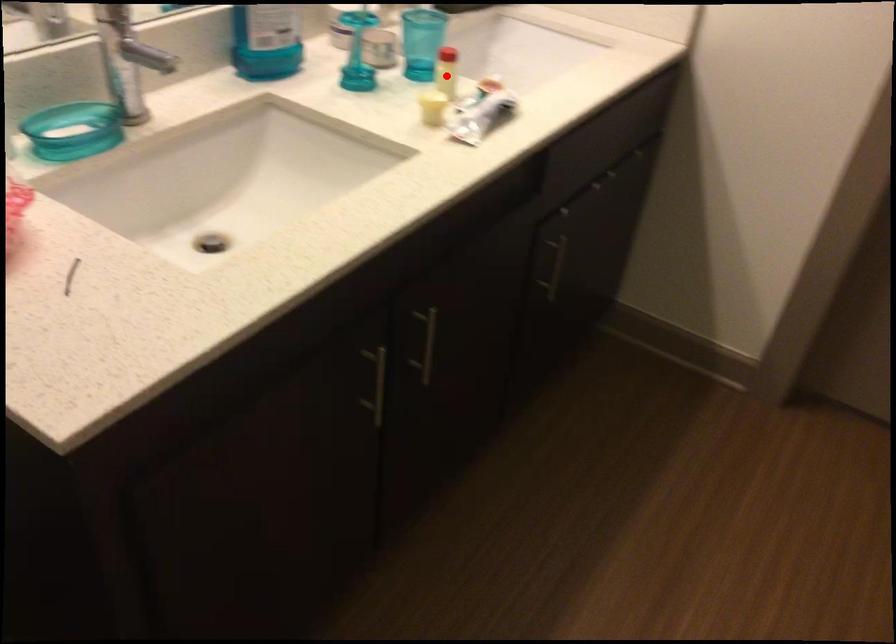
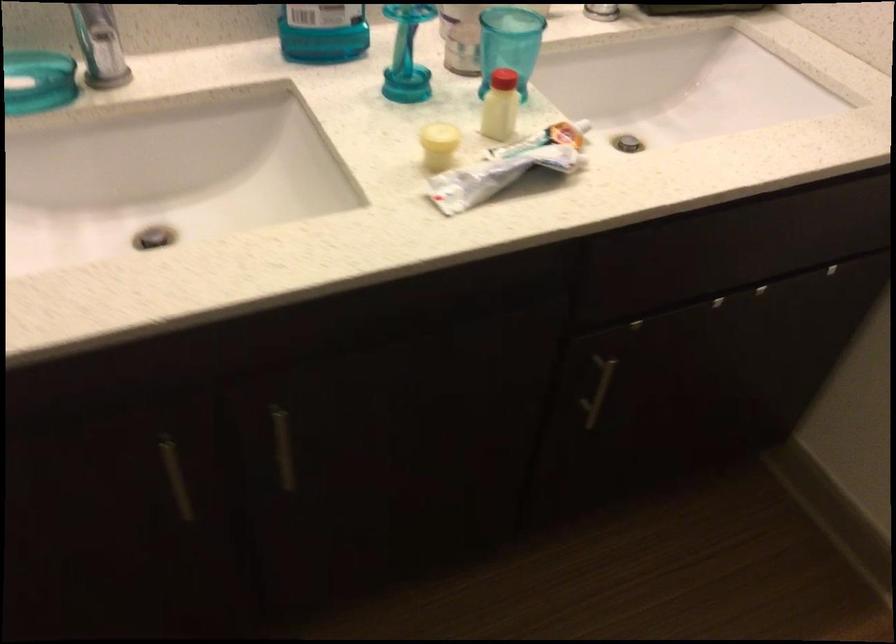
Question: I am providing you with two images of the same scene from different viewpoints. A red point is marked on the first image. At the location where the point appears in image 1, is it still visible in image 2?

Choices:
 (A) Yes
 (B) No

Answer: (A)